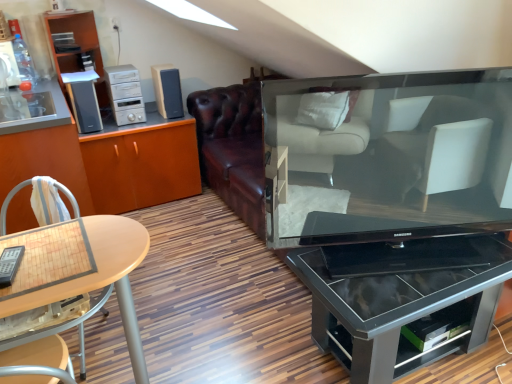
Locate an element on the screen. The width and height of the screenshot is (512, 384). vacant space situated above black glass table at center (from a real-world perspective) is located at coordinates (412, 266).